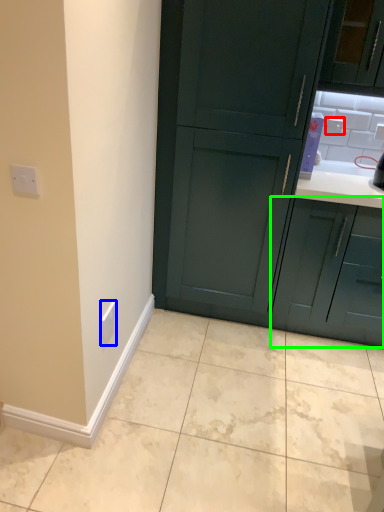
Question: Which object is the closest to the electric outlet (highlighted by a red box)? Choose among these: electric outlet (highlighted by a blue box) or cabinetry (highlighted by a green box).

Choices:
 (A) electric outlet
 (B) cabinetry

Answer: (B)